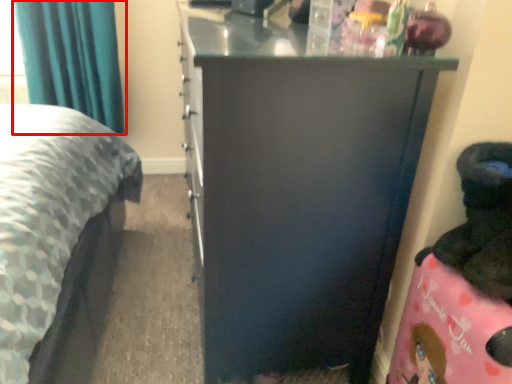
Question: From the image's perspective, where is curtain (annotated by the red box) located relative to furniture?

Choices:
 (A) below
 (B) above

Answer: (B)